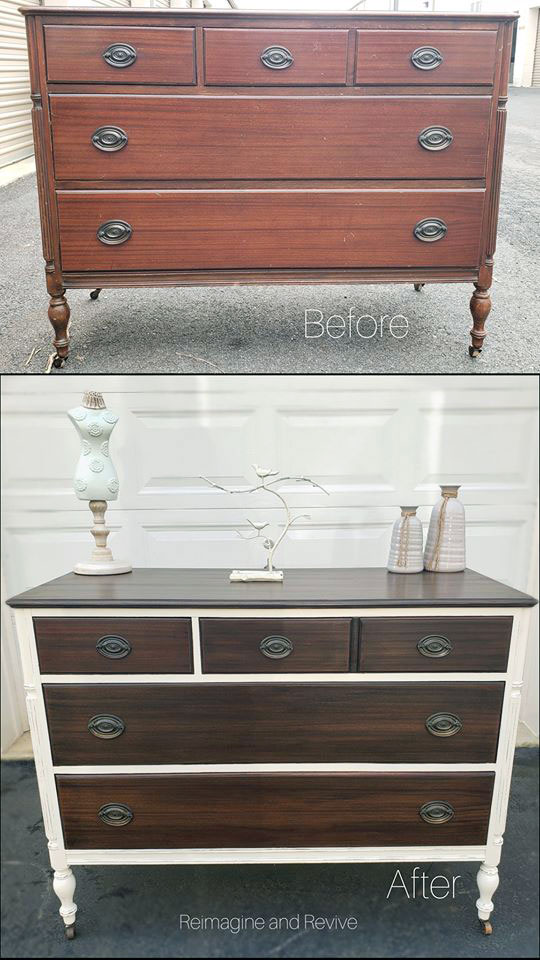
What are the coordinates of `decor` in the screenshot? It's located at (98, 463), (400, 539), (445, 523), (258, 571).